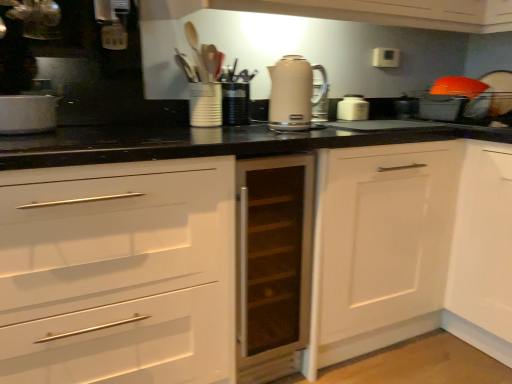
Question: Do you think matte white container at center, acting as the 1th appliance starting from the left, is within beige glossy electric kettle at center, the second kitchen appliance from the right, or outside of it?

Choices:
 (A) outside
 (B) inside

Answer: (A)

Question: From a real-world perspective, is matte white container at center, which is counted as the 2th appliance, starting from the right, above or below beige glossy electric kettle at center, placed as the second kitchen appliance when sorted from back to front?

Choices:
 (A) above
 (B) below

Answer: (B)

Question: Which object is positioned farthest from the satin silver wine cooler at center, the 1th kitchen appliance in the left-to-right sequence?

Choices:
 (A) matte white container at center, acting as the 1th appliance starting from the left
 (B) white matte cabinet at lower right, the second cabinetry viewed from the left
 (C) white glossy toaster at center, which appears as the 1th kitchen appliance when viewed from the right
 (D) transparent glass cabinet at center, the 1th cabinetry positioned from the left
 (E) beige glossy electric kettle at center, placed as the 2th kitchen appliance when sorted from front to back

Answer: (C)

Question: Estimate the real-world distances between objects in this image. Which object is closer to the black plastic container at center, which ranks as the second appliance in left-to-right order?

Choices:
 (A) beige glossy electric kettle at center, the second kitchen appliance from the right
 (B) matte white container at center, acting as the 1th appliance starting from the left
 (C) white matte cabinet at lower right, which appears as the 1th cabinetry when viewed from the right
 (D) white glossy toaster at center, the first kitchen appliance positioned from the back
 (E) satin silver wine cooler at center, the third kitchen appliance in the back-to-front sequence

Answer: (B)